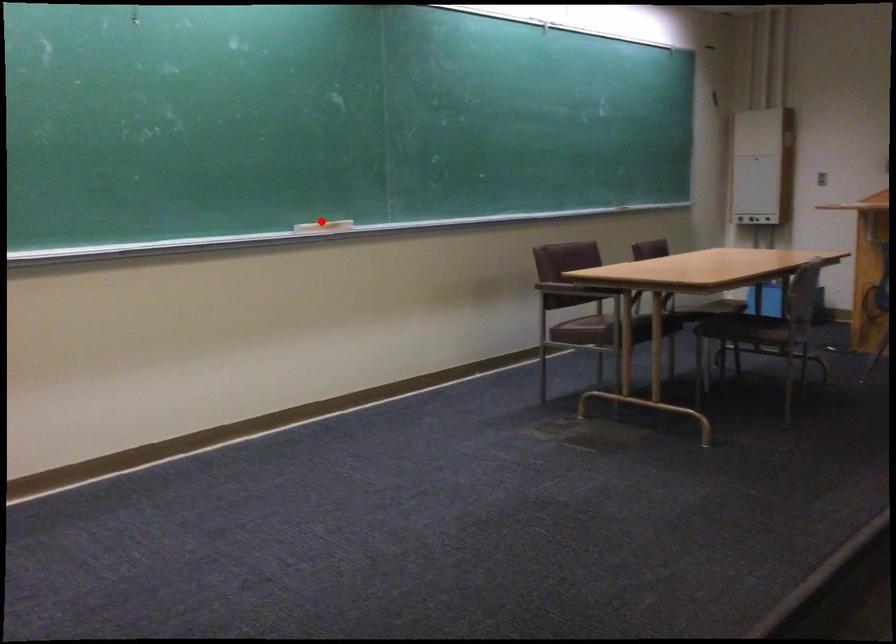
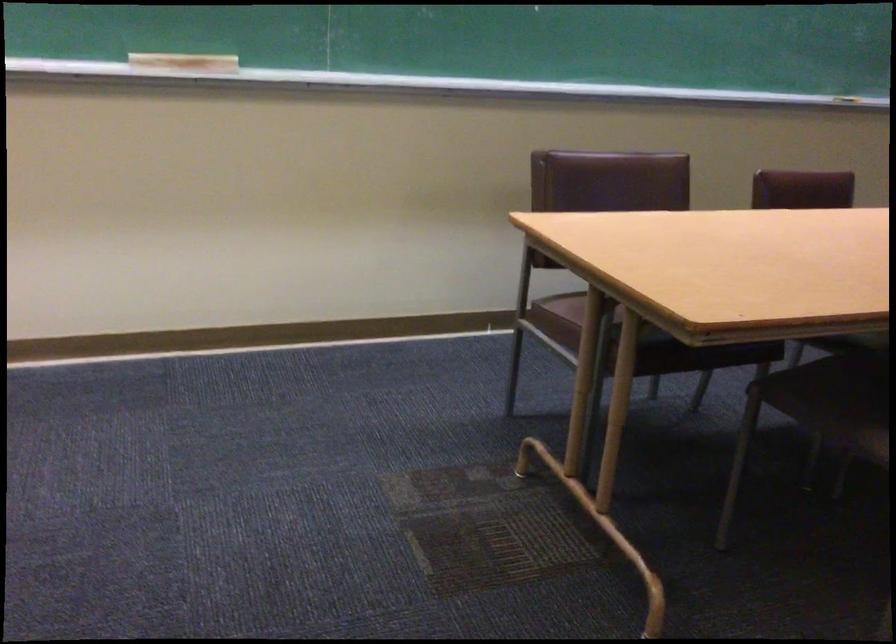
Locate, in the second image, the point that corresponds to the highlighted location in the first image.

(183, 64)